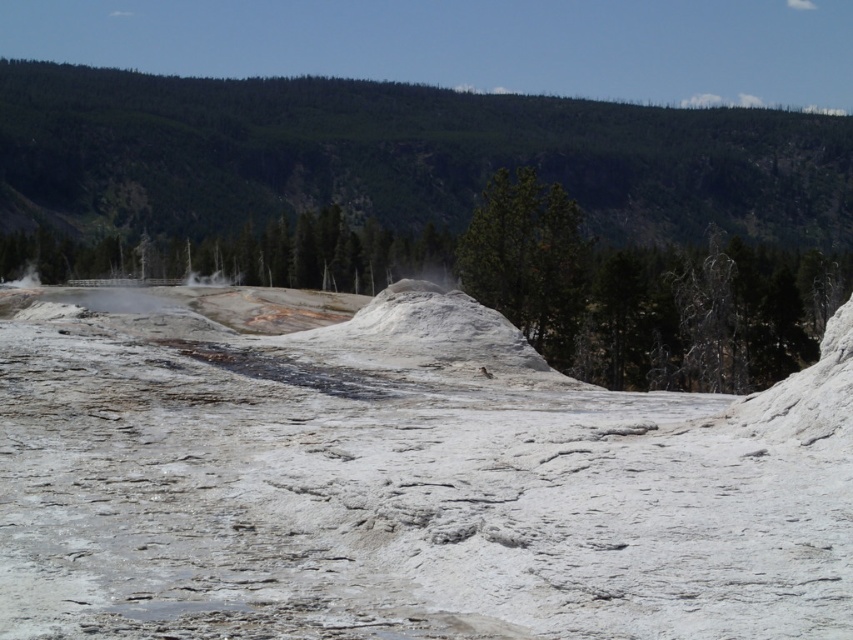
Question: Is white matte snow at center closer to camera compared to green forested mountain at upper center?

Choices:
 (A) no
 (B) yes

Answer: (B)

Question: Does white matte snow at center lie in front of green forested mountain at upper center?

Choices:
 (A) yes
 (B) no

Answer: (A)

Question: Which point is farther from the camera taking this photo?

Choices:
 (A) (123, 483)
 (B) (793, 211)

Answer: (B)

Question: Is the position of white matte snow at center more distant than that of green forested mountain at upper center?

Choices:
 (A) yes
 (B) no

Answer: (B)